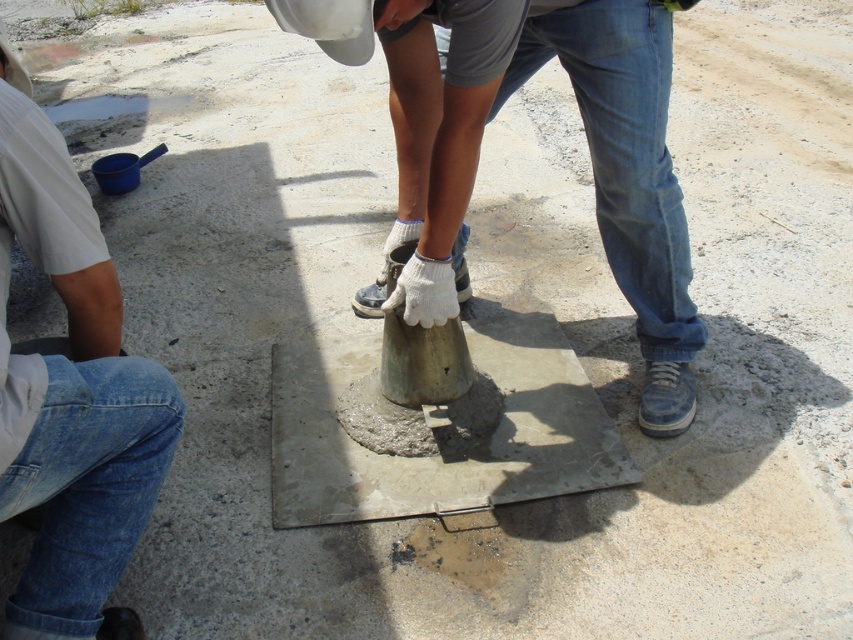
Question: Which point is closer to the camera?

Choices:
 (A) denim jeans at left
 (B) metallic gray cone at center

Answer: (A)

Question: Which object is closer to the camera taking this photo?

Choices:
 (A) metallic gray cone at center
 (B) denim jeans at left

Answer: (B)

Question: Can you confirm if metallic gray cone at center is positioned to the right of denim jeans at left?

Choices:
 (A) yes
 (B) no

Answer: (A)

Question: Does metallic gray cone at center appear on the left side of denim jeans at left?

Choices:
 (A) yes
 (B) no

Answer: (B)

Question: Can you confirm if metallic gray cone at center is thinner than denim jeans at left?

Choices:
 (A) no
 (B) yes

Answer: (A)